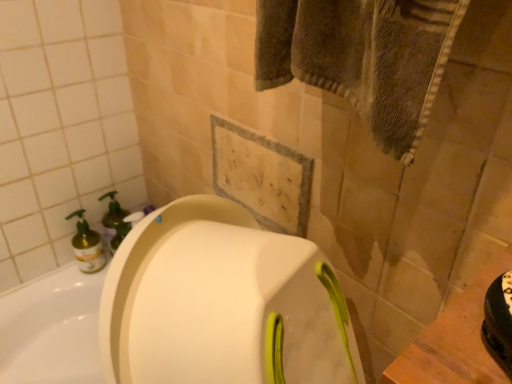
Question: From the image's perspective, is translucent plastic soap dispenser at left located above or below translucent yellow bottle at left?

Choices:
 (A) below
 (B) above

Answer: (B)

Question: From a real-world perspective, is translucent plastic soap dispenser at left positioned above or below translucent yellow bottle at left?

Choices:
 (A) above
 (B) below

Answer: (A)

Question: Based on their positions, is translucent plastic soap dispenser at left located to the left or right of translucent yellow bottle at left?

Choices:
 (A) right
 (B) left

Answer: (A)

Question: From a real-world perspective, is translucent yellow bottle at left positioned above or below translucent plastic soap dispenser at left?

Choices:
 (A) above
 (B) below

Answer: (B)

Question: Is translucent yellow bottle at left wider or thinner than translucent plastic soap dispenser at left?

Choices:
 (A) thin
 (B) wide

Answer: (B)

Question: From the image's perspective, is translucent yellow bottle at left above or below translucent plastic soap dispenser at left?

Choices:
 (A) below
 (B) above

Answer: (A)

Question: Looking at the image, does translucent yellow bottle at left seem bigger or smaller compared to translucent plastic soap dispenser at left?

Choices:
 (A) big
 (B) small

Answer: (B)